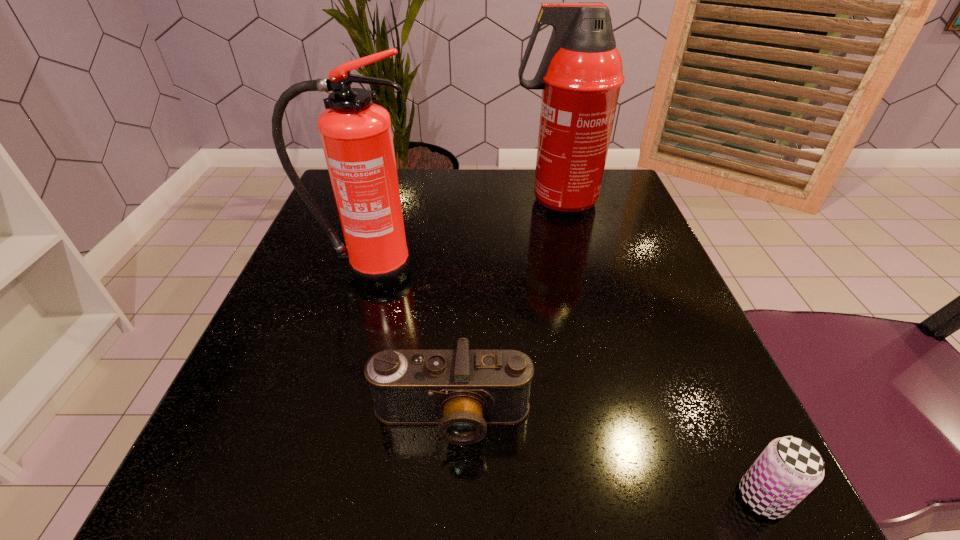
Where is `vacant space situated at the nozzle of the left fire extinguisher`? vacant space situated at the nozzle of the left fire extinguisher is located at coordinates (322, 424).

At what (x,y) coordinates should I click in order to perform the action: click on free space located on the lens of the second nearest object. Please return your answer as a coordinate pair (x, y). Looking at the image, I should click on coord(447,504).

Identify the location of free space located on the back of the rightmost object. The width and height of the screenshot is (960, 540). (653, 265).

I want to click on object that is at the far edge, so click(x=581, y=72).

Identify the location of camera at the near edge. This screenshot has width=960, height=540. (462, 391).

Find the location of a particular element. beer can at the near edge is located at coordinates (789, 468).

This screenshot has width=960, height=540. What are the coordinates of `object present at the left edge` in the screenshot? It's located at (356, 135).

Image resolution: width=960 pixels, height=540 pixels. What are the coordinates of `fire extinguisher that is at the right edge` in the screenshot? It's located at (581, 72).

Where is `beer can at the right edge`? The width and height of the screenshot is (960, 540). beer can at the right edge is located at coordinates point(789,468).

I want to click on object at the far right corner, so click(x=581, y=72).